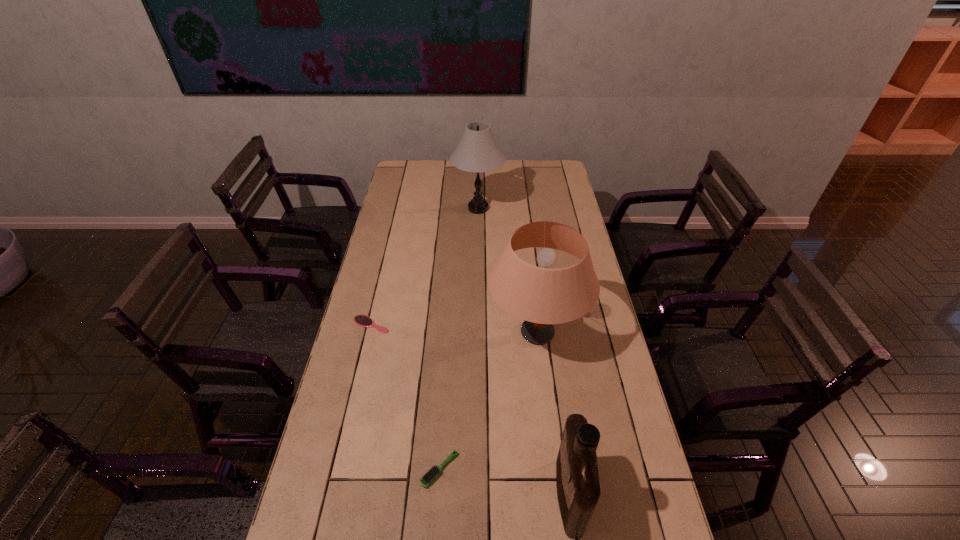
Choose which object is the second nearest neighbor to the lampshade. Please provide its 2D coordinates. Your answer should be formatted as a tuple, i.e. [(x, y)], where the tuple contains the x and y coordinates of a point satisfying the conditions above.

[(577, 478)]